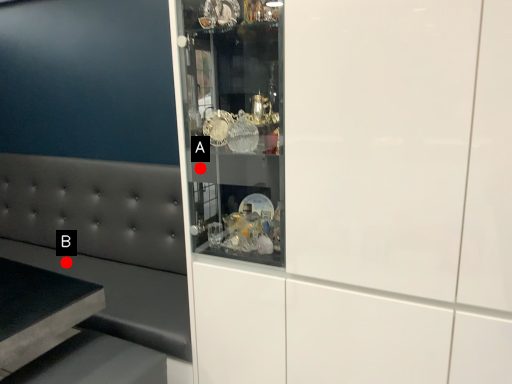
Question: Two points are circled on the image, labeled by A and B beside each circle. Which point is closer to the camera?

Choices:
 (A) A is closer
 (B) B is closer

Answer: (A)